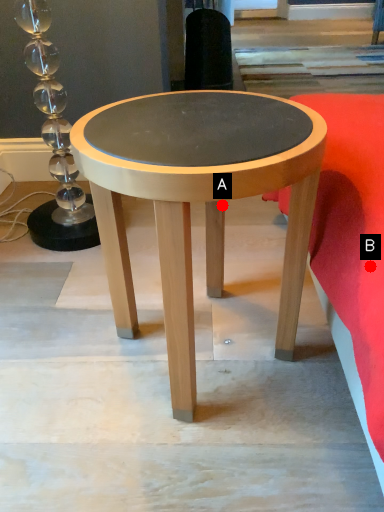
Question: Two points are circled on the image, labeled by A and B beside each circle. Which point is further to the camera?

Choices:
 (A) A is further
 (B) B is further

Answer: (A)